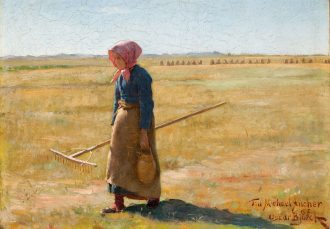
I want to click on art piece, so click(294, 134).